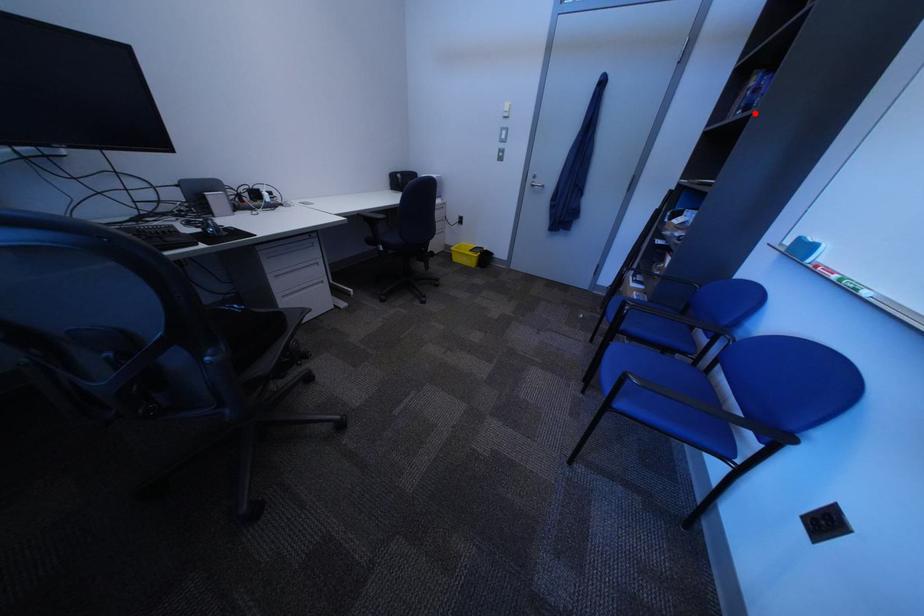
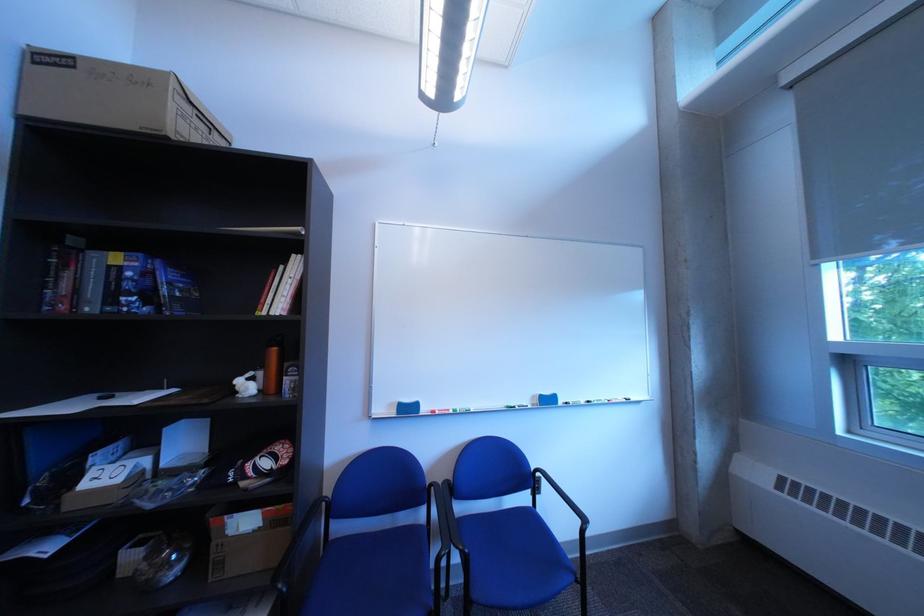
Question: I am providing you with two images of the same scene from different viewpoints. A red point is marked on the first image. Can you still see the location of the red point in image 2?

Choices:
 (A) Yes
 (B) No

Answer: (A)